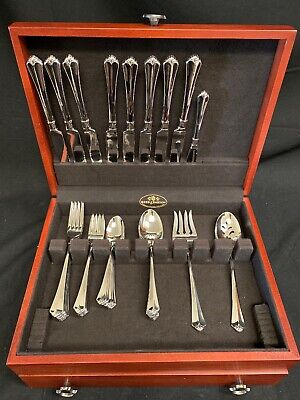
I want to click on knives, so (62, 150), (75, 147), (94, 145), (111, 145), (125, 146), (143, 147), (160, 147), (176, 145), (192, 155).